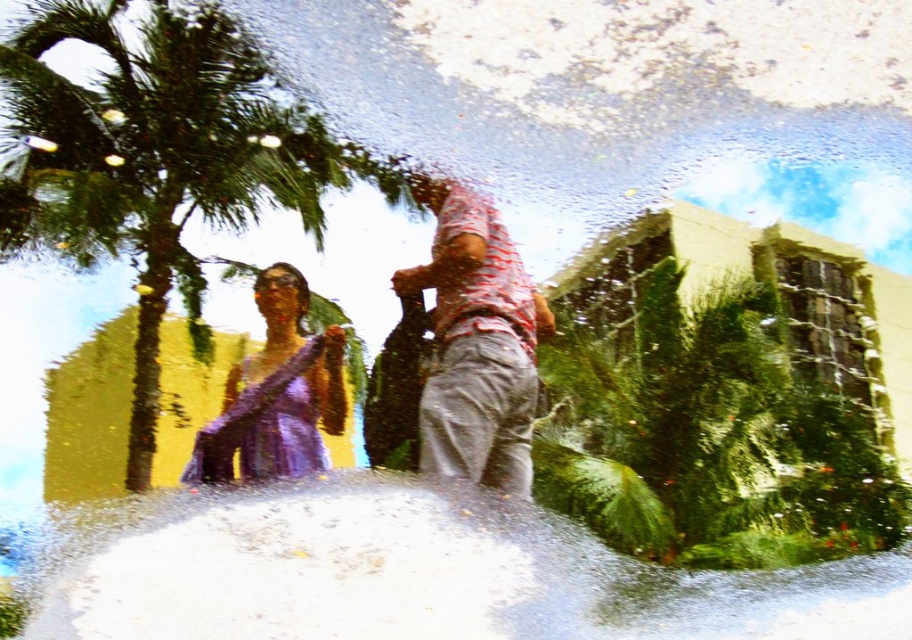
You are a fashion designer observing a photo shoot in a tropical garden. You notice the striped cotton shirt at center and the purple satin dress at left. Which clothing item appears taller in the image?

The striped cotton shirt at center is taller than the purple satin dress at left in the image.

You are a photographer trying to capture a clear shot of both the striped cotton shirt at center and the purple satin dress at left. Given that your camera has a maximum focus range of 25 inches, will you need to adjust your position to ensure both subjects are in focus?

The distance between the striped cotton shirt at center and the purple satin dress at left is 27.87 inches, which exceeds the camera maximum focus range of 25 inches. You will need to move closer to reduce the distance between them to ensure both are in focus.